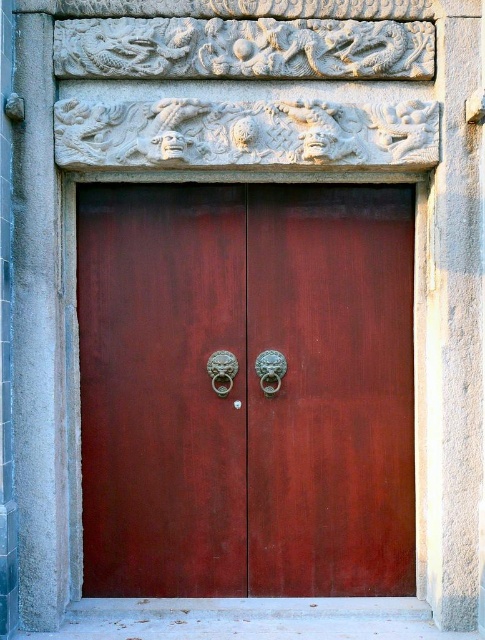
Can you confirm if glossy wood door at center is positioned above gold metallic lion head at center?

Incorrect, glossy wood door at center is not positioned above gold metallic lion head at center.

Which is more to the left, glossy wood door at center or gold metallic lion head at center?

Positioned to the left is gold metallic lion head at center.

Is point (178, 593) farther from viewer compared to point (228, 352)?

No, (178, 593) is in front of (228, 352).

Identify the location of glossy wood door at center. (246, 390).

Does glossy wood door at center have a larger size compared to green metallic lion head at center?

Yes, glossy wood door at center is bigger than green metallic lion head at center.

Who is more distant from viewer, (144, 465) or (275, 378)?

The point (144, 465) is behind.

Between point (364, 490) and point (262, 360), which one is positioned behind?

The point (364, 490) is behind.

Find the location of `glossy wood door at center`. glossy wood door at center is located at coordinates pos(246,390).

This screenshot has width=485, height=640. I want to click on green metallic lion head at center, so click(x=270, y=371).

Does green metallic lion head at center appear over gold metallic lion head at center?

Yes.

You are a GUI agent. You are given a task and a screenshot of the screen. Output one action in this format:
    pyautogui.click(x=<x>, y=<y>)
    Task: Click on the green metallic lion head at center
    This screenshot has width=485, height=640.
    Given the screenshot: What is the action you would take?
    pyautogui.click(x=270, y=371)

Image resolution: width=485 pixels, height=640 pixels. I want to click on green metallic lion head at center, so click(x=270, y=371).